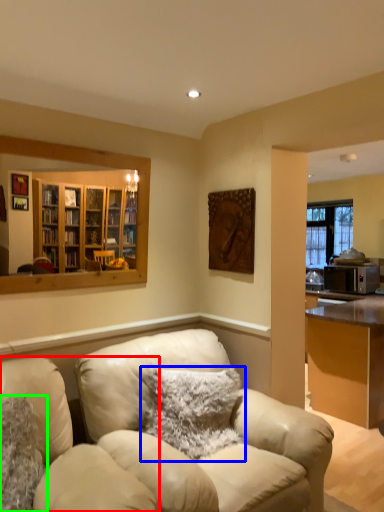
Question: Which is farther away from chair (highlighted by a red box)? pillow (highlighted by a blue box) or pillow (highlighted by a green box)?

Choices:
 (A) pillow
 (B) pillow

Answer: (A)